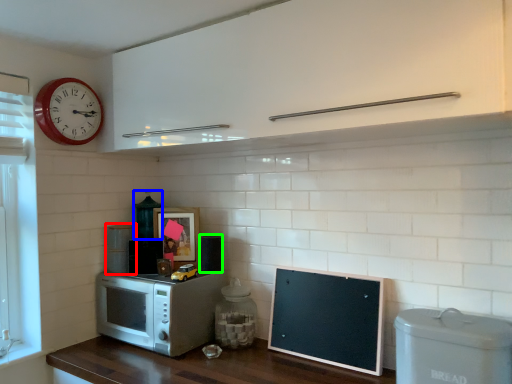
Question: Which object is positioned closest to appliance (highlighted by a red box)? Select from appliance (highlighted by a blue box) and appliance (highlighted by a green box).

Choices:
 (A) appliance
 (B) appliance

Answer: (A)